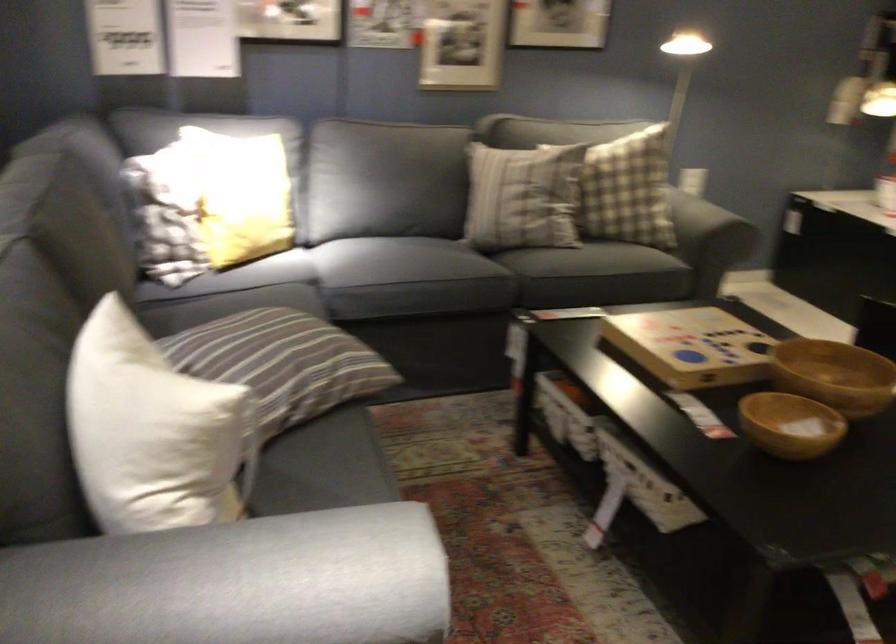
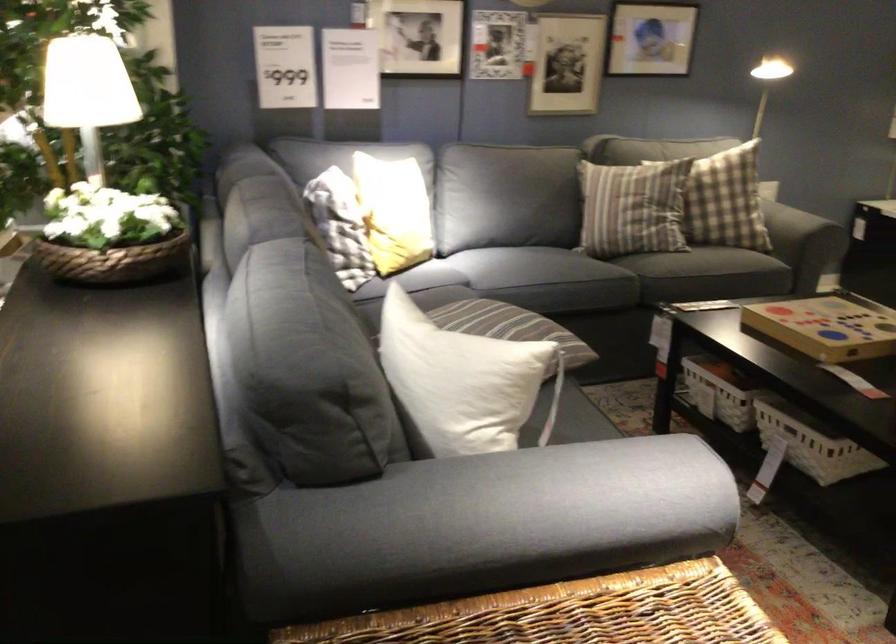
The point at (221, 200) is marked in the first image. Where is the corresponding point in the second image?

(392, 212)